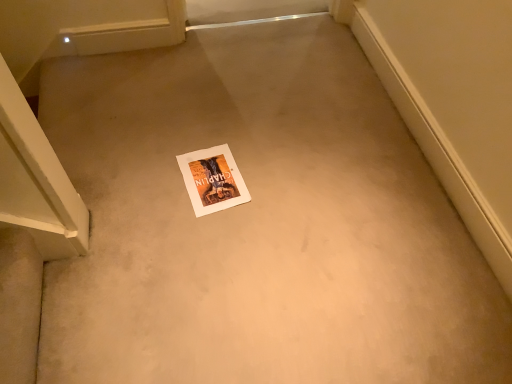
Image resolution: width=512 pixels, height=384 pixels. What are the coordinates of `empty space that is to the right of carpeted stairs at lower left` in the screenshot? It's located at (115, 308).